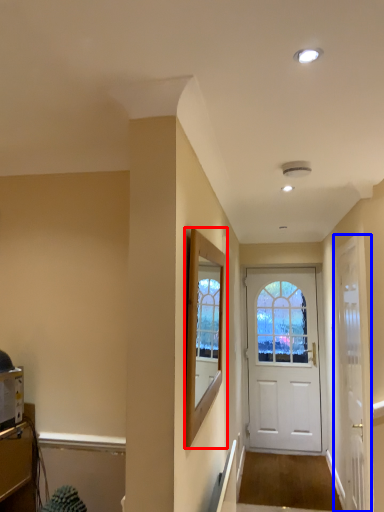
Question: Among these objects, which one is nearest to the camera, window screen (highlighted by a red box) or door (highlighted by a blue box)?

Choices:
 (A) window screen
 (B) door

Answer: (A)